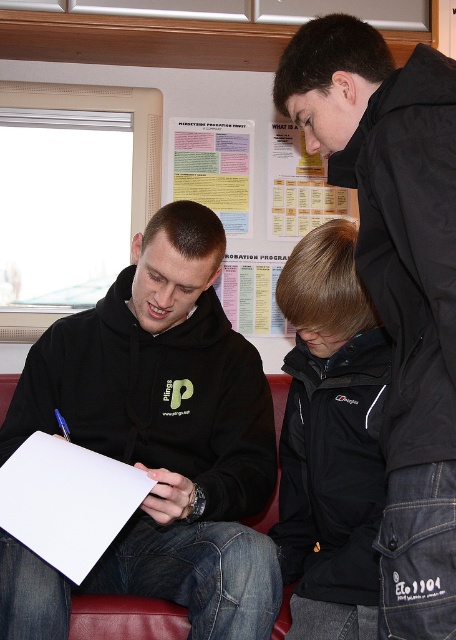
Who is more forward, (446, 236) or (188, 145)?

Point (446, 236) is more forward.

Who is more distant from viewer, (408, 570) or (231, 179)?

The point (231, 179) is more distant.

Locate an element on the screen. The image size is (456, 640). black matte jacket at upper right is located at coordinates (397, 282).

Find the location of a particular element. black softshell jacket at lower right is located at coordinates click(330, 440).

Identify the location of black softshell jacket at lower right. Image resolution: width=456 pixels, height=640 pixels. (330, 440).

Image resolution: width=456 pixels, height=640 pixels. Identify the location of black softshell jacket at lower right. pyautogui.click(x=330, y=440).

Does black softshell jacket at lower right lie in front of yellow paper poster at upper center?

Yes.

Which is in front, point (330, 566) or point (279, 237)?

Point (330, 566) is in front.

Identify the location of black softshell jacket at lower right. (330, 440).